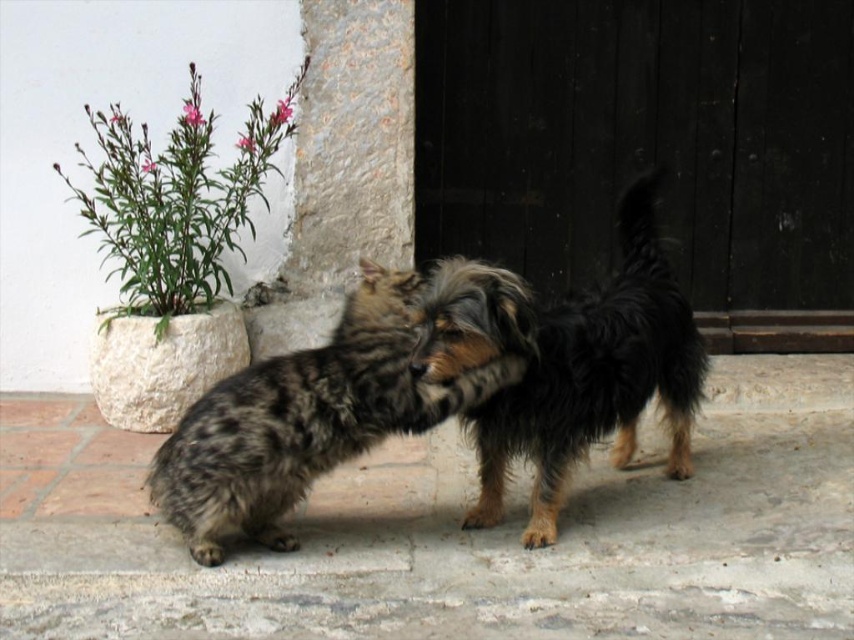
In the scene shown: Is shaggy brown dog at center wider than fluffy brown dog at center?

In fact, shaggy brown dog at center might be narrower than fluffy brown dog at center.

Between point (557, 488) and point (411, 394), which one is positioned in front?

Point (411, 394)

Measure the distance between shaggy brown dog at center and camera.

shaggy brown dog at center and camera are 10.58 feet apart from each other.

This screenshot has width=854, height=640. Find the location of `shaggy brown dog at center`. shaggy brown dog at center is located at coordinates (566, 364).

Can you confirm if fluffy brown dog at center is wider than green leafy plant at upper left?

Yes, fluffy brown dog at center is wider than green leafy plant at upper left.

Where is `fluffy brown dog at center`? Image resolution: width=854 pixels, height=640 pixels. fluffy brown dog at center is located at coordinates (305, 419).

I want to click on fluffy brown dog at center, so click(x=305, y=419).

The image size is (854, 640). What do you see at coordinates (566, 364) in the screenshot?
I see `shaggy brown dog at center` at bounding box center [566, 364].

The image size is (854, 640). I want to click on shaggy brown dog at center, so pyautogui.click(x=566, y=364).

Identify the location of shaggy brown dog at center. (566, 364).